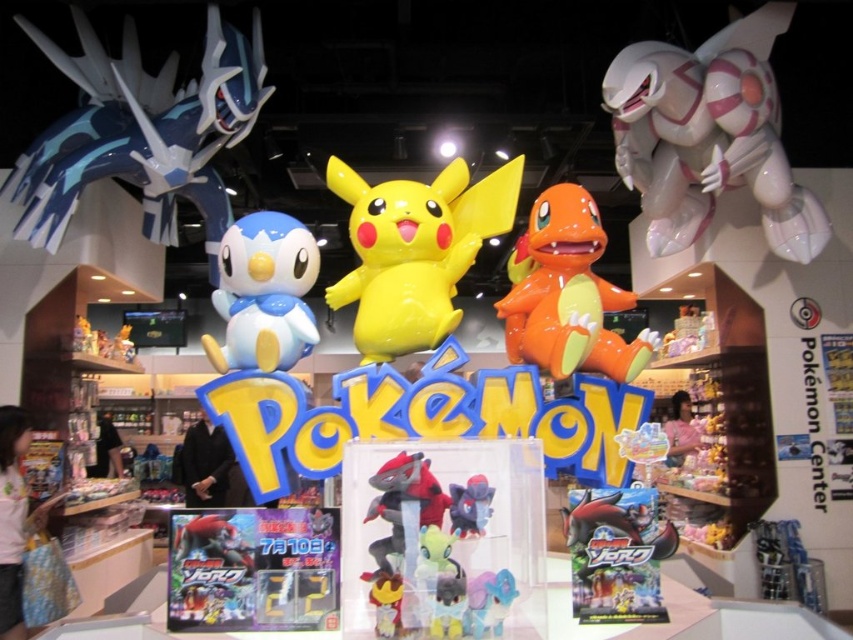
Does glossy plastic penguin at upper left have a greater width compared to matte gray plush at center?

Indeed, glossy plastic penguin at upper left has a greater width compared to matte gray plush at center.

Which is above, glossy plastic penguin at upper left or matte gray plush at center?

glossy plastic penguin at upper left

Is point (181, 176) in front of point (466, 481)?

No.

Locate an element on the screen. This screenshot has width=853, height=640. glossy plastic penguin at upper left is located at coordinates (141, 132).

Is shiny orange plastic charmander at center above shiny plastic toy at center?

Indeed, shiny orange plastic charmander at center is positioned over shiny plastic toy at center.

Between point (585, 264) and point (627, 570), which one is positioned in front?

Point (627, 570) is more forward.

Where is `shiny orange plastic charmander at center`? shiny orange plastic charmander at center is located at coordinates [566, 292].

Where is `shiny orange plastic charmander at center`? The height and width of the screenshot is (640, 853). shiny orange plastic charmander at center is located at coordinates (566, 292).

Can you confirm if yellow matte pikachu at center is taller than matte blue plush at center?

Correct, yellow matte pikachu at center is much taller as matte blue plush at center.

Between yellow matte pikachu at center and matte blue plush at center, which one has more height?

Standing taller between the two is yellow matte pikachu at center.

Find the location of a particular element. The image size is (853, 640). yellow matte pikachu at center is located at coordinates pos(415,250).